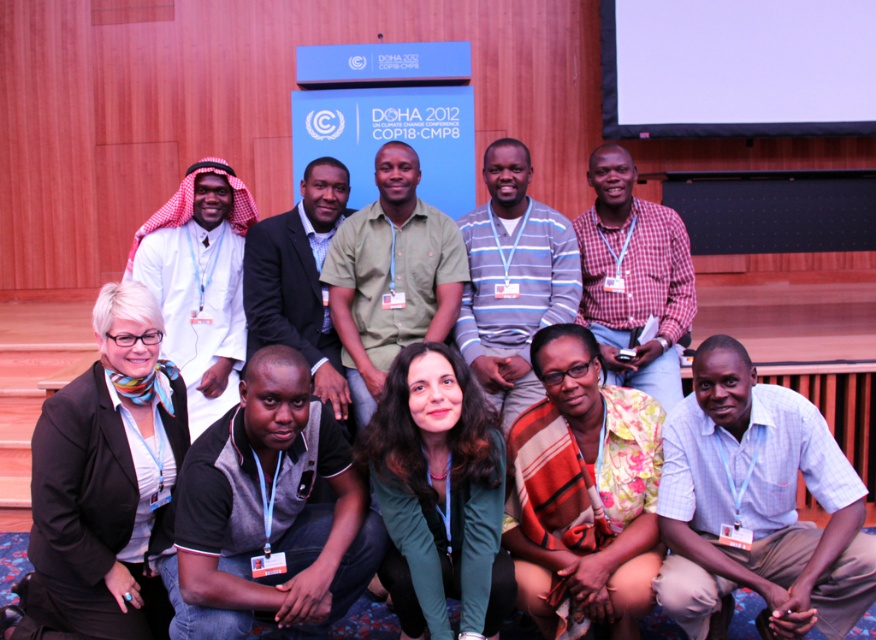
You are a photographer trying to adjust the composition of the group photo. You notice the black matte blazer at lower left and the striped cotton shirt at center. Which clothing item is positioned lower in the frame?

The black matte blazer at lower left is positioned lower in the frame than the striped cotton shirt at center.

You are a photographer at the event and want to ensure that the black jersey at lower left and the white cotton kufi at upper left are both visible in the photo. Based on their positions, which object is closer to the camera?

The black jersey at lower left is positioned under the white cotton kufi at upper left, meaning it is closer to the camera since it appears below and in front of the kufi.

You are a photographer trying to capture a clear shot of both the black jersey at lower left and the white cotton kufi at upper left. Given that your camera has a depth of field that can focus on objects within a 3.5 feet range, will both items be in focus simultaneously?

The black jersey at lower left is 3.81 feet away from the white cotton kufi at upper left. Since the distance between them exceeds the camera sensor depth of field of 3.5 feet, the photographer cannot have both items in focus simultaneously.